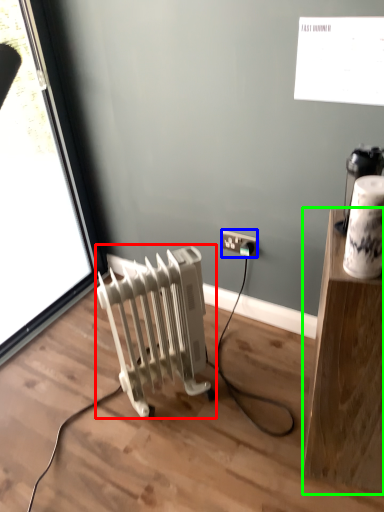
Question: Which is nearer to the radiator (highlighted by a red box)? power plugs and sockets (highlighted by a blue box) or furniture (highlighted by a green box).

Choices:
 (A) power plugs and sockets
 (B) furniture

Answer: (A)